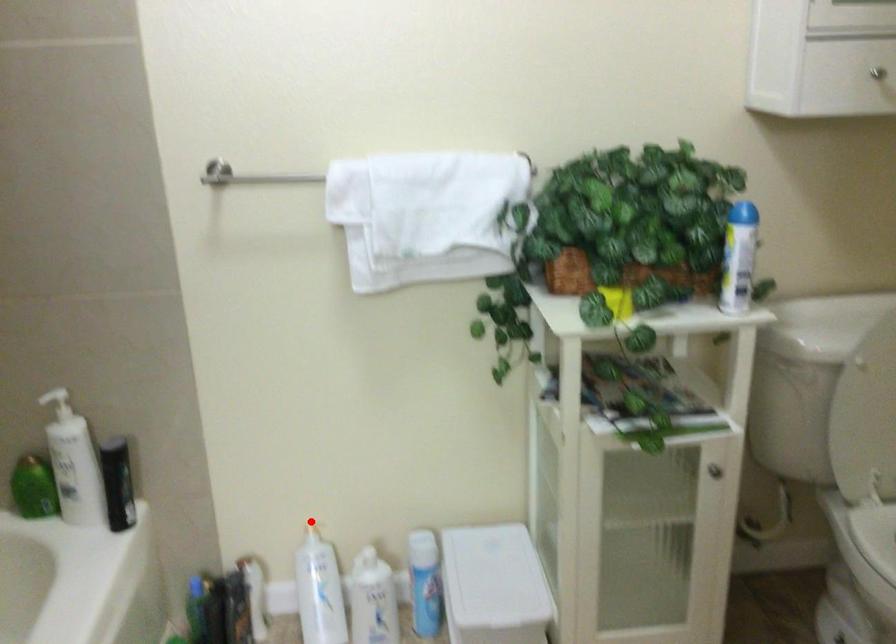
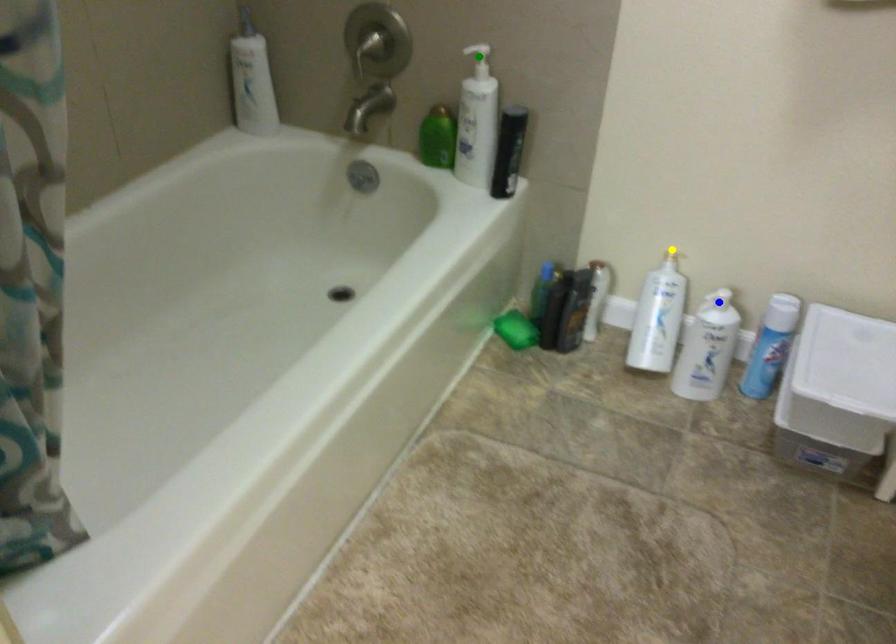
Question: I am providing you with two images of the same scene from different viewpoints. A red point is marked on the first image. You are given multiple points on the second image. Can you choose the point in image 2 that corresponds to the point in image 1?

Choices:
 (A) green point
 (B) blue point
 (C) yellow point

Answer: (C)